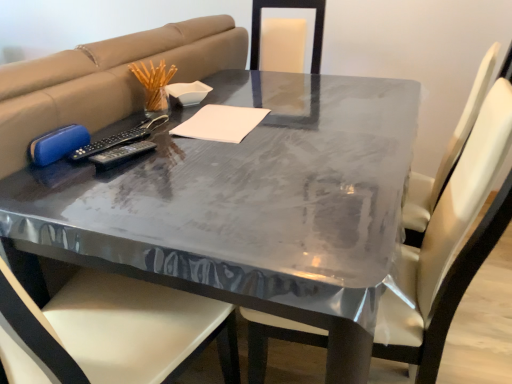
Image resolution: width=512 pixels, height=384 pixels. Identify the location of free space between black plastic remote at center and white paper at center. (180, 150).